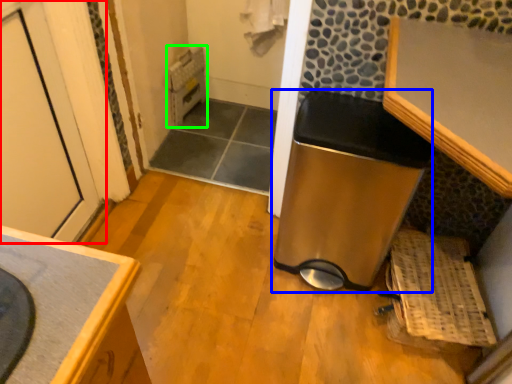
Question: Based on their relative distances, which object is farther from door (highlighted by a red box)? Choose from water heater (highlighted by a blue box) and water heater (highlighted by a green box).

Choices:
 (A) water heater
 (B) water heater

Answer: (A)